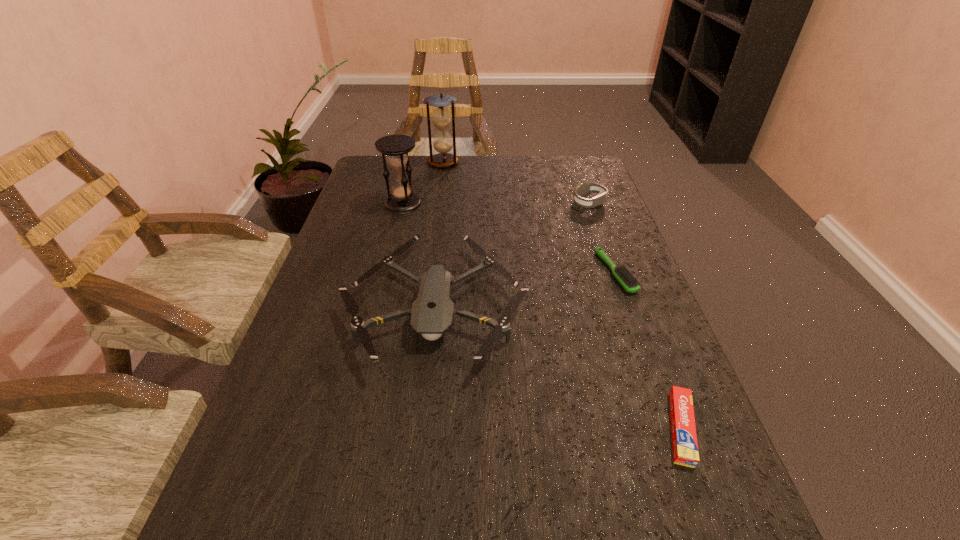
Where is `the farther hourglass`? The height and width of the screenshot is (540, 960). the farther hourglass is located at coordinates (441, 117).

You are a GUI agent. You are given a task and a screenshot of the screen. Output one action in this format:
    pyautogui.click(x=<x>, y=<y>)
    Task: Click on the fifth shortest object
    
    Given the screenshot: What is the action you would take?
    pyautogui.click(x=402, y=200)

Find the location of a particular element. This screenshot has width=960, height=540. the shorter hourglass is located at coordinates (402, 200).

The height and width of the screenshot is (540, 960). In order to click on watch in this screenshot , I will do `click(583, 188)`.

Identify the location of drone. The image size is (960, 540). (431, 314).

You are a GUI agent. You are given a task and a screenshot of the screen. Output one action in this format:
    pyautogui.click(x=<x>, y=<y>)
    Task: Click on the second shortest object
    This screenshot has width=960, height=540.
    Given the screenshot: What is the action you would take?
    pyautogui.click(x=622, y=274)

Identify the location of toothpaste. This screenshot has height=540, width=960. (684, 439).

Image resolution: width=960 pixels, height=540 pixels. Identify the location of the nearest object. (684, 439).

At what (x,y) coordinates should I click in order to perform the action: click on vacant space located on the left of the farther hourglass. Please return your answer as a coordinate pair (x, y). Image resolution: width=960 pixels, height=540 pixels. Looking at the image, I should click on (365, 163).

Where is `free space located on the back of the nearer hourglass`? This screenshot has height=540, width=960. free space located on the back of the nearer hourglass is located at coordinates [x=408, y=183].